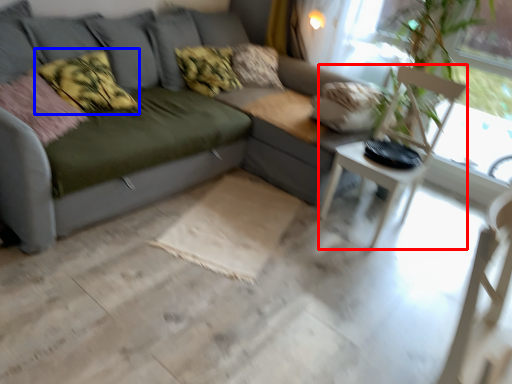
Question: Which object is closer to the camera taking this photo, armchair (highlighted by a red box) or pillow (highlighted by a blue box)?

Choices:
 (A) armchair
 (B) pillow

Answer: (A)